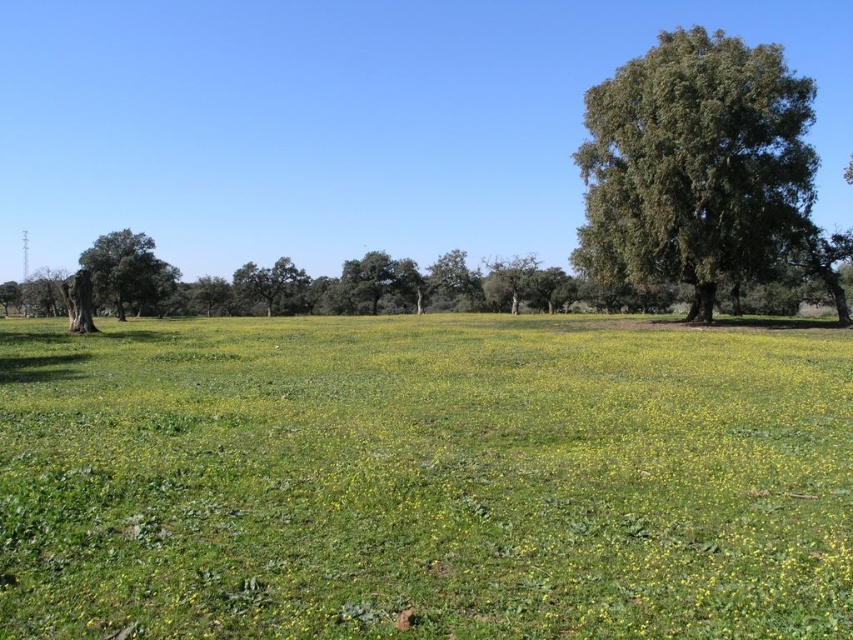
Is green leafy tree at right below smooth green tree at left?

No.

Does green leafy tree at right have a lesser width compared to smooth green tree at left?

No.

Where is `green leafy tree at right`? green leafy tree at right is located at coordinates (695, 164).

This screenshot has height=640, width=853. In order to click on green leafy tree at right in this screenshot , I will do `click(695, 164)`.

At what (x,y) coordinates should I click in order to perform the action: click on green grassy field at center. Please return your answer as a coordinate pair (x, y). The image size is (853, 640). Looking at the image, I should click on (422, 481).

How much distance is there between green grassy field at center and green matte tree at center?

green grassy field at center and green matte tree at center are 259.85 feet apart from each other.

Is point (628, 604) less distant than point (286, 266)?

Yes, it is.

The height and width of the screenshot is (640, 853). I want to click on green grassy field at center, so click(422, 481).

Between green leafy tree at right and green matte tree at center, which one has less height?

Standing shorter between the two is green matte tree at center.

Does green leafy tree at right have a lesser width compared to green matte tree at center?

In fact, green leafy tree at right might be wider than green matte tree at center.

You are a GUI agent. You are given a task and a screenshot of the screen. Output one action in this format:
    pyautogui.click(x=<x>, y=<y>)
    Task: Click on the green leafy tree at right
    This screenshot has height=640, width=853.
    Given the screenshot: What is the action you would take?
    pyautogui.click(x=695, y=164)